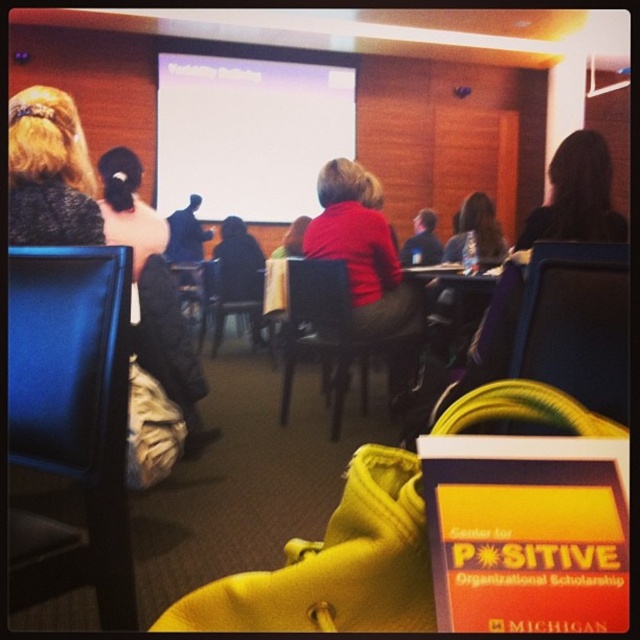
Which is above, matte red sweater at center or matte black chair at center?

matte black chair at center is higher up.

Is matte red sweater at center taller than matte black chair at center?

Correct, matte red sweater at center is much taller as matte black chair at center.

Which is in front, point (339, 230) or point (253, 324)?

Point (339, 230) is in front.

The height and width of the screenshot is (640, 640). Find the location of `matte red sweater at center`. matte red sweater at center is located at coordinates (362, 250).

Does white matte projection screen at upper center have a greater height compared to matte red sweater at center?

Yes, white matte projection screen at upper center is taller than matte red sweater at center.

Who is more distant from viewer, (200, 83) or (387, 241)?

Point (200, 83)

At what (x,y) coordinates should I click in order to perform the action: click on white matte projection screen at upper center. Please return your answer as a coordinate pair (x, y). This screenshot has height=640, width=640. Looking at the image, I should click on (248, 132).

Who is positioned more to the right, black leather chair at center or wooden chair at center?

Positioned to the right is black leather chair at center.

Which is behind, point (557, 340) or point (298, 264)?

The point (298, 264) is behind.

This screenshot has width=640, height=640. I want to click on black leather chair at center, so click(577, 323).